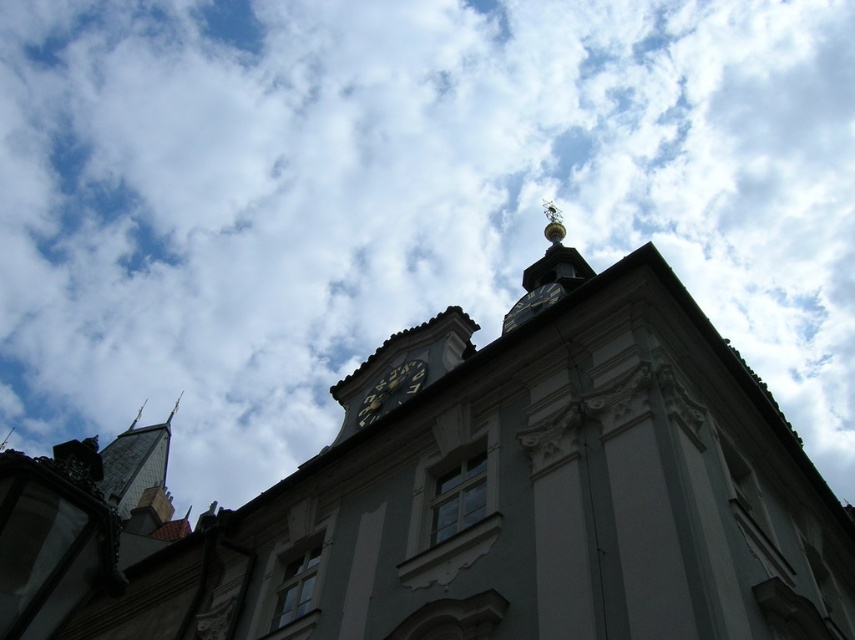
Is gray stone tower at left to the right of gold metallic clock at upper center from the viewer's perspective?

No, gray stone tower at left is not to the right of gold metallic clock at upper center.

Who is positioned more to the right, gray stone tower at left or gold metallic clock at upper center?

gold metallic clock at upper center

Where is `gray stone tower at left`? The width and height of the screenshot is (855, 640). gray stone tower at left is located at coordinates (134, 464).

Does gray stone tower at left appear under black metal clock at center?

Yes, gray stone tower at left is below black metal clock at center.

Find the location of `gray stone tower at left`. gray stone tower at left is located at coordinates pyautogui.click(x=134, y=464).

Locate an element on the screen. The height and width of the screenshot is (640, 855). gray stone tower at left is located at coordinates (134, 464).

Is the position of black metal clock at center less distant than that of gold metallic clock at upper center?

Yes, it is in front of gold metallic clock at upper center.

Who is more forward, (382, 385) or (540, 300)?

Positioned in front is point (382, 385).

Is point (416, 364) farther from camera compared to point (503, 316)?

No.

What are the coordinates of `black metal clock at center` in the screenshot? It's located at (391, 390).